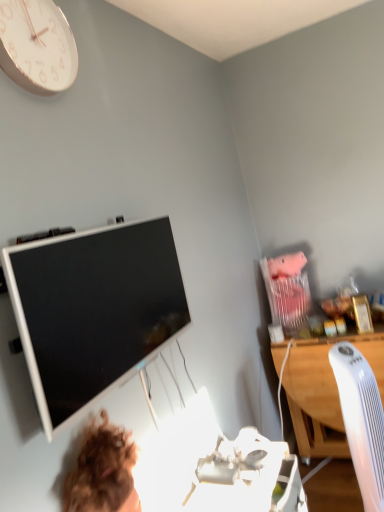
Question: Does white glossy clock at upper left have a greater height compared to white wood desk at right?

Choices:
 (A) no
 (B) yes

Answer: (A)

Question: Can you confirm if white glossy clock at upper left is wider than white wood desk at right?

Choices:
 (A) no
 (B) yes

Answer: (A)

Question: Does white glossy clock at upper left have a smaller size compared to white wood desk at right?

Choices:
 (A) yes
 (B) no

Answer: (A)

Question: Is white glossy clock at upper left closer to the viewer compared to white wood desk at right?

Choices:
 (A) yes
 (B) no

Answer: (A)

Question: Does white glossy clock at upper left have a larger size compared to white wood desk at right?

Choices:
 (A) yes
 (B) no

Answer: (B)

Question: From the image's perspective, is white glossy television at upper left located above or below white plastic computer chair at right?

Choices:
 (A) above
 (B) below

Answer: (A)

Question: Is white glossy television at upper left taller or shorter than white plastic computer chair at right?

Choices:
 (A) short
 (B) tall

Answer: (A)

Question: Is white glossy television at upper left inside the boundaries of white plastic computer chair at right, or outside?

Choices:
 (A) outside
 (B) inside

Answer: (A)

Question: Is white glossy television at upper left in front of or behind white plastic computer chair at right in the image?

Choices:
 (A) behind
 (B) front

Answer: (B)

Question: In the image, is white plastic computer chair at right positioned in front of or behind white glossy television at upper left?

Choices:
 (A) front
 (B) behind

Answer: (B)

Question: Considering the positions of white plastic computer chair at right and white glossy television at upper left in the image, is white plastic computer chair at right taller or shorter than white glossy television at upper left?

Choices:
 (A) short
 (B) tall

Answer: (B)

Question: Does point (349, 423) appear closer or farther from the camera than point (48, 360)?

Choices:
 (A) closer
 (B) farther

Answer: (B)

Question: From the image's perspective, is white plastic computer chair at right positioned above or below white glossy television at upper left?

Choices:
 (A) below
 (B) above

Answer: (A)

Question: Is white plastic computer chair at right wider or thinner than white wood desk at right?

Choices:
 (A) wide
 (B) thin

Answer: (B)

Question: From the image's perspective, is white plastic computer chair at right located above or below white wood desk at right?

Choices:
 (A) below
 (B) above

Answer: (A)